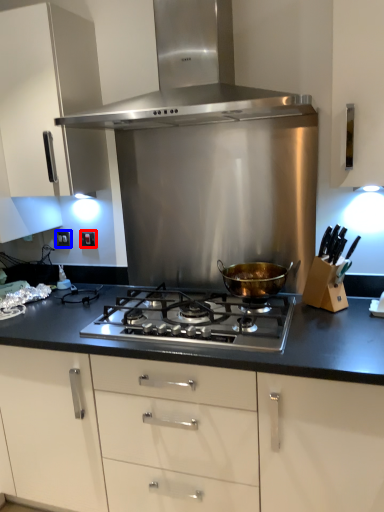
Question: Which object appears farthest to the camera in this image, electric outlet (highlighted by a red box) or electric outlet (highlighted by a blue box)?

Choices:
 (A) electric outlet
 (B) electric outlet

Answer: (B)